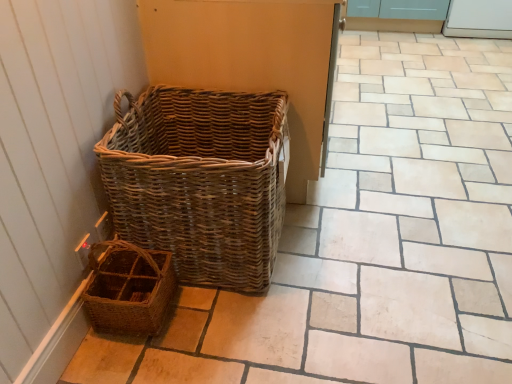
Question: Is the depth of white glossy screen door at upper right greater than that of brown woven picnic basket at lower left, acting as the 1th picnic basket starting from the bottom?

Choices:
 (A) yes
 (B) no

Answer: (A)

Question: Is white glossy screen door at upper right facing towards brown woven picnic basket at lower left, acting as the 1th picnic basket starting from the bottom?

Choices:
 (A) yes
 (B) no

Answer: (A)

Question: From a real-world perspective, is white glossy screen door at upper right located beneath brown woven picnic basket at lower left, acting as the 1th picnic basket starting from the bottom?

Choices:
 (A) yes
 (B) no

Answer: (B)

Question: From a real-world perspective, is white glossy screen door at upper right located higher than brown woven picnic basket at lower left, acting as the 1th picnic basket starting from the bottom?

Choices:
 (A) yes
 (B) no

Answer: (A)

Question: Is the depth of white glossy screen door at upper right less than that of brown woven picnic basket at lower left, acting as the 1th picnic basket starting from the bottom?

Choices:
 (A) no
 (B) yes

Answer: (A)

Question: Considering their positions, is natural wicker picnic basket at left, which is the first picnic basket in top-to-bottom order, located in front of or behind brown woven picnic basket at lower left, acting as the 1th picnic basket starting from the bottom?

Choices:
 (A) behind
 (B) front

Answer: (B)

Question: From a real-world perspective, is natural wicker picnic basket at left, which is the first picnic basket in top-to-bottom order, positioned above or below brown woven picnic basket at lower left, acting as the 1th picnic basket starting from the bottom?

Choices:
 (A) below
 (B) above

Answer: (B)

Question: Considering the positions of natural wicker picnic basket at left, placed as the second picnic basket when sorted from bottom to top, and brown woven picnic basket at lower left, acting as the 1th picnic basket starting from the bottom, in the image, is natural wicker picnic basket at left, placed as the second picnic basket when sorted from bottom to top, wider or thinner than brown woven picnic basket at lower left, acting as the 1th picnic basket starting from the bottom,?

Choices:
 (A) wide
 (B) thin

Answer: (A)

Question: Based on their positions, is natural wicker picnic basket at left, placed as the second picnic basket when sorted from bottom to top, located to the left or right of brown woven picnic basket at lower left, acting as the 1th picnic basket starting from the bottom?

Choices:
 (A) left
 (B) right

Answer: (B)

Question: From the image's perspective, is natural wicker picnic basket at left, placed as the second picnic basket when sorted from bottom to top, located above or below white glossy screen door at upper right?

Choices:
 (A) below
 (B) above

Answer: (A)

Question: Is natural wicker picnic basket at left, which is the first picnic basket in top-to-bottom order, bigger or smaller than white glossy screen door at upper right?

Choices:
 (A) big
 (B) small

Answer: (A)

Question: Considering the positions of natural wicker picnic basket at left, placed as the second picnic basket when sorted from bottom to top, and white glossy screen door at upper right in the image, is natural wicker picnic basket at left, placed as the second picnic basket when sorted from bottom to top, wider or thinner than white glossy screen door at upper right?

Choices:
 (A) thin
 (B) wide

Answer: (A)

Question: Considering their positions, is natural wicker picnic basket at left, which is the first picnic basket in top-to-bottom order, located in front of or behind white glossy screen door at upper right?

Choices:
 (A) behind
 (B) front

Answer: (B)

Question: From the image's perspective, is white glossy screen door at upper right positioned above or below natural wicker picnic basket at left, placed as the second picnic basket when sorted from bottom to top?

Choices:
 (A) above
 (B) below

Answer: (A)

Question: Is white glossy screen door at upper right in front of or behind natural wicker picnic basket at left, placed as the second picnic basket when sorted from bottom to top, in the image?

Choices:
 (A) behind
 (B) front

Answer: (A)